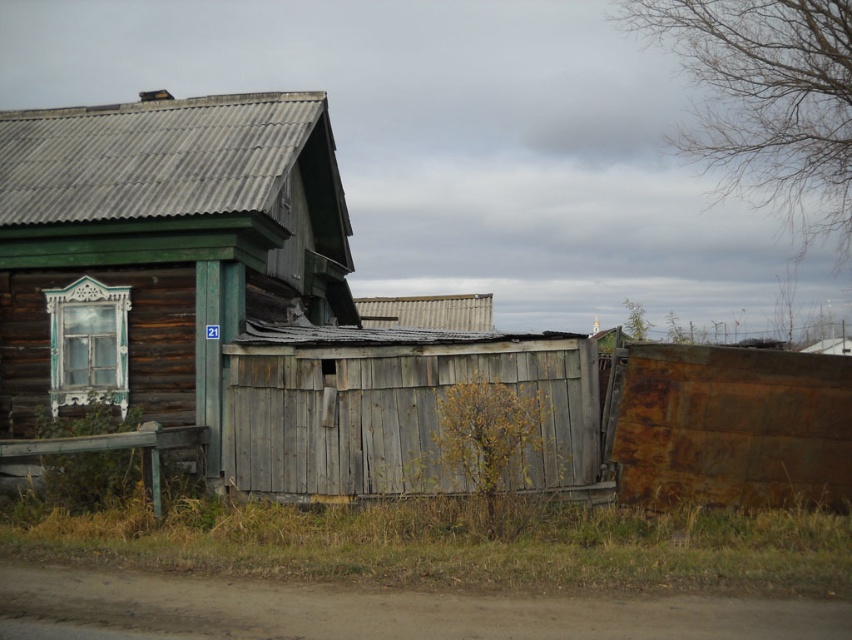
Question: Does weathered wood hut at upper left lie in front of rusty metal fence at right?

Choices:
 (A) no
 (B) yes

Answer: (A)

Question: Which of the following is the closest to the observer?

Choices:
 (A) rusty metal fence at right
 (B) weathered wood hut at upper left

Answer: (A)

Question: Can you confirm if weathered wood hut at upper left is positioned below rusty metal fence at right?

Choices:
 (A) yes
 (B) no

Answer: (B)

Question: Can you confirm if weathered wood hut at upper left is smaller than rusty metal fence at right?

Choices:
 (A) no
 (B) yes

Answer: (A)

Question: Which point is farther to the camera?

Choices:
 (A) rusty metal fence at right
 (B) weathered wood hut at upper left

Answer: (B)